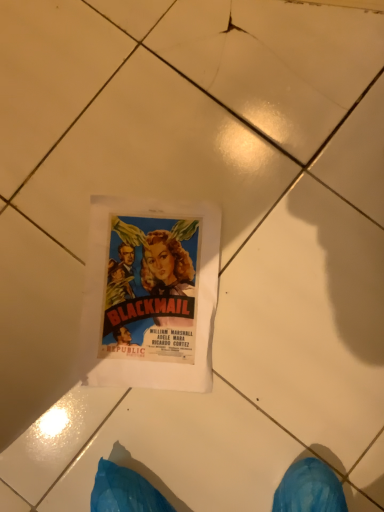
Where is `matte paper poster at center`? The height and width of the screenshot is (512, 384). matte paper poster at center is located at coordinates (150, 294).

Image resolution: width=384 pixels, height=512 pixels. What do you see at coordinates (150, 294) in the screenshot?
I see `matte paper poster at center` at bounding box center [150, 294].

Measure the distance between point (106,314) and camera.

Point (106,314) is 26.34 inches away from camera.

What are the coordinates of `matte paper poster at center` in the screenshot? It's located at (150, 294).